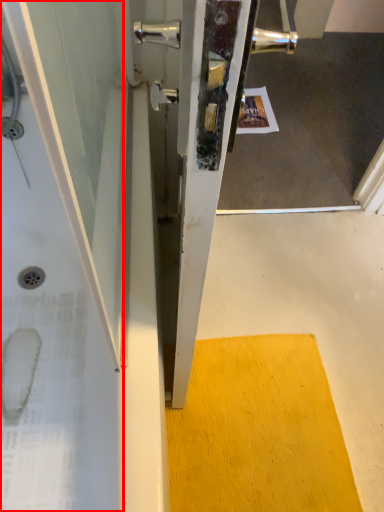
Question: Considering the relative positions of bath (annotated by the red box) and doormat in the image provided, where is bath (annotated by the red box) located with respect to the staircase?

Choices:
 (A) right
 (B) left

Answer: (B)